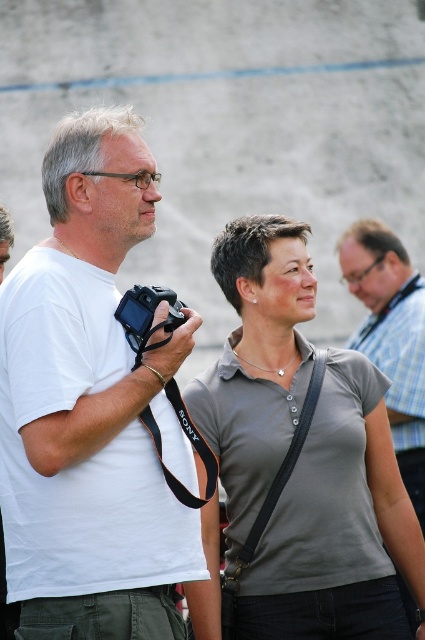
Question: Can you confirm if gray matte shirt at center is positioned to the right of black plastic camera at left?

Choices:
 (A) no
 (B) yes

Answer: (B)

Question: Is white matte camera at left positioned in front of plaid fabric shirt at center?

Choices:
 (A) yes
 (B) no

Answer: (A)

Question: Considering the real-world distances, which object is closest to the black plastic camera at left?

Choices:
 (A) plaid fabric shirt at center
 (B) gray matte shirt at center

Answer: (B)

Question: Is plaid fabric shirt at center positioned at the back of black plastic camera at left?

Choices:
 (A) no
 (B) yes

Answer: (B)

Question: Among these objects, which one is nearest to the camera?

Choices:
 (A) white matte camera at left
 (B) black plastic camera at left
 (C) gray matte shirt at center
 (D) plaid fabric shirt at center

Answer: (A)

Question: Which of these objects is positioned closest to the gray matte shirt at center?

Choices:
 (A) black plastic camera at left
 (B) white matte camera at left

Answer: (B)